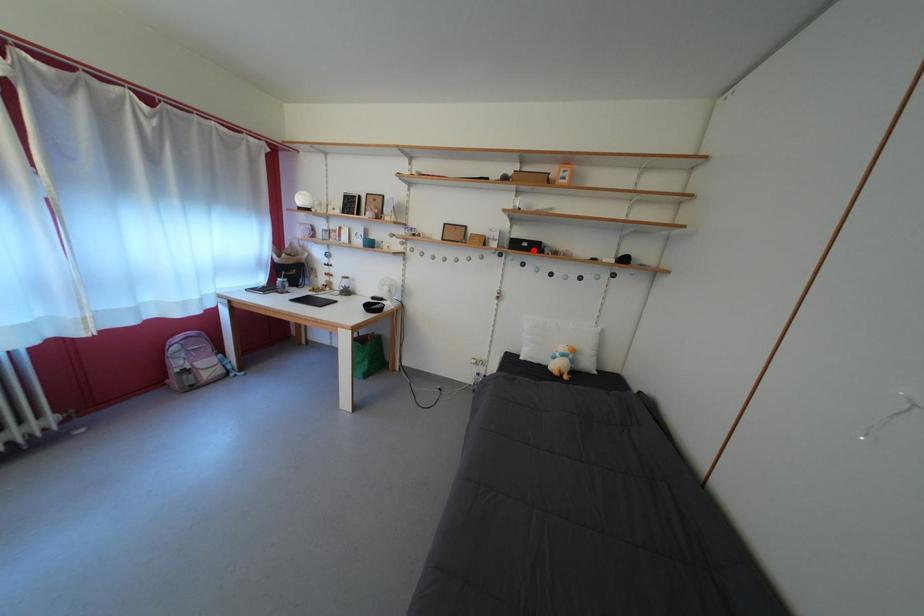
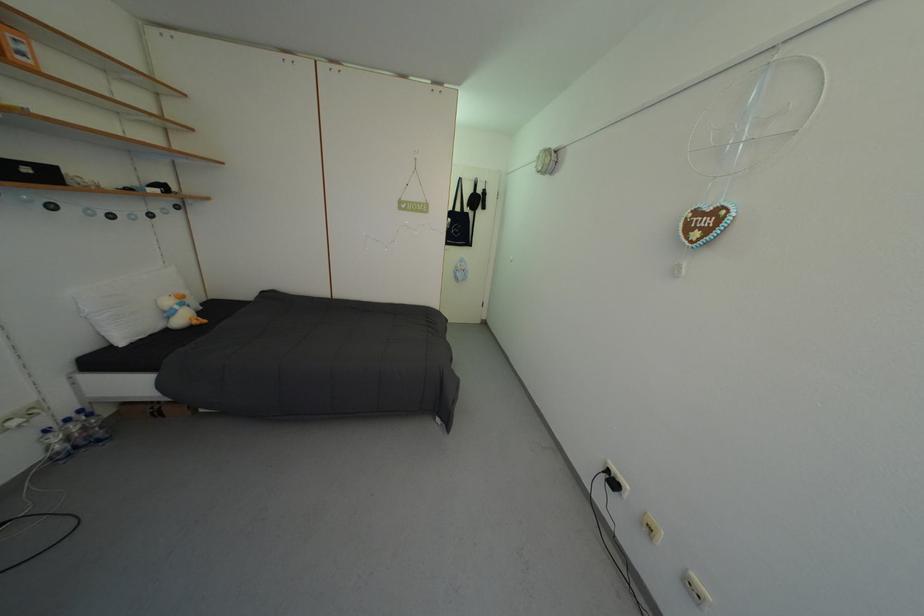
Question: I am providing you with two images of the same scene from different viewpoints. Given a red point in image1, look at the same physical point in image2. Is it:

Choices:
 (A) Closer to the viewpoint
 (B) Farther from the viewpoint

Answer: (B)